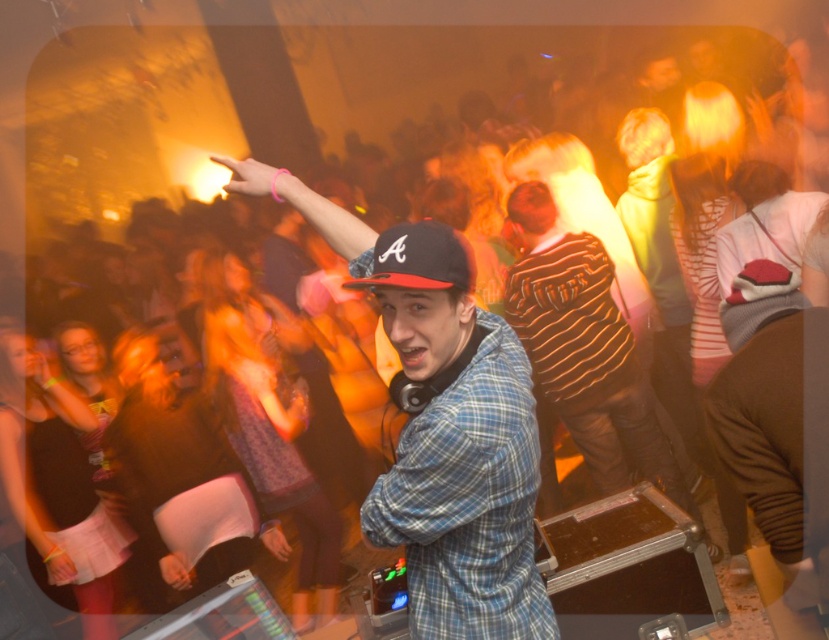
You are a photographer at the nightclub scene. You want to capture a photo of the central figure pointing towards a specific spot. The two points you are considering are point (453, 356) and point (393, 260). According to the scene description, which point is further away from the camera?

Point (453, 356) is behind point (393, 260), so it is further away from the camera.

You are a photographer at the nightclub scene. You want to take a photo of the blue plaid shirt at center. What are the coordinates to focus on?

Answer: The coordinates to focus on for the blue plaid shirt at center are point (445, 436).

You are a photographer at the nightclub. You want to take a photo of the central figure wearing the blue plaid shirt at center and the black matte baseball cap at center. Based on their positions, can you tell which item is closer to the camera?

The blue plaid shirt at center is below the black matte baseball cap at center, which means the black matte baseball cap at center is closer to the camera.